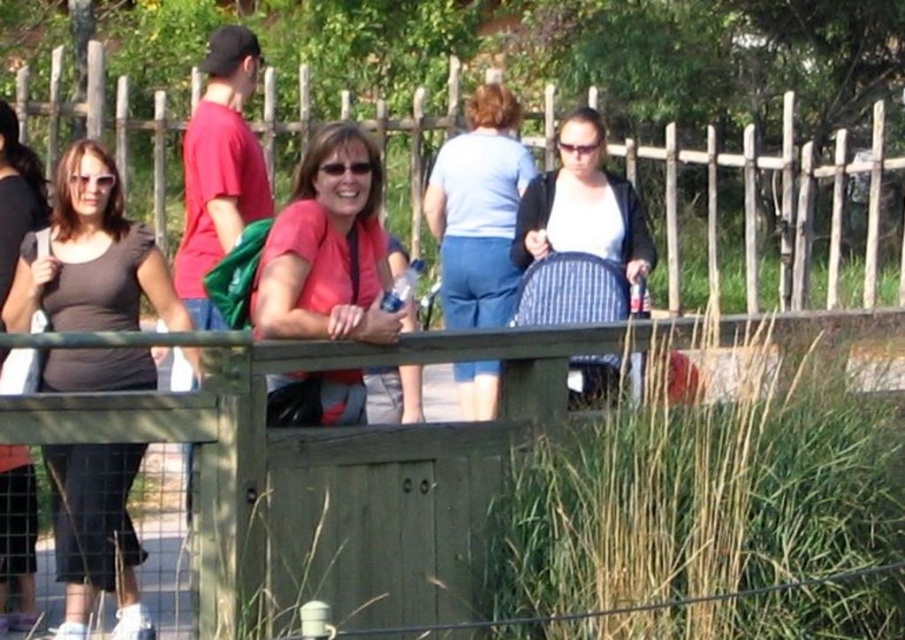
Is point (321, 378) behind point (503, 289)?

That is False.

Is matte pink shirt at center taller than light blue denim pants at center?

In fact, matte pink shirt at center may be shorter than light blue denim pants at center.

Which is in front, point (415, 397) or point (465, 282)?

Positioned in front is point (415, 397).

Image resolution: width=905 pixels, height=640 pixels. Find the location of `matte pink shirt at center`. matte pink shirt at center is located at coordinates (329, 250).

The height and width of the screenshot is (640, 905). I want to click on matte black shirt at left, so click(91, 257).

Who is lower down, matte black shirt at left or striped fabric stroller at center?

matte black shirt at left

Where is `matte black shirt at left`? This screenshot has width=905, height=640. matte black shirt at left is located at coordinates (91, 257).

At what (x,y) coordinates should I click in order to perform the action: click on matte black shirt at left. Please return your answer as a coordinate pair (x, y). Looking at the image, I should click on (91, 257).

Which is in front, point (64, 163) or point (350, 221)?

Point (350, 221) is in front.

Between point (102, 314) and point (272, 336), which one is positioned in front?

Point (272, 336) is in front.

Where is `matte black shirt at left`? This screenshot has width=905, height=640. matte black shirt at left is located at coordinates (91, 257).